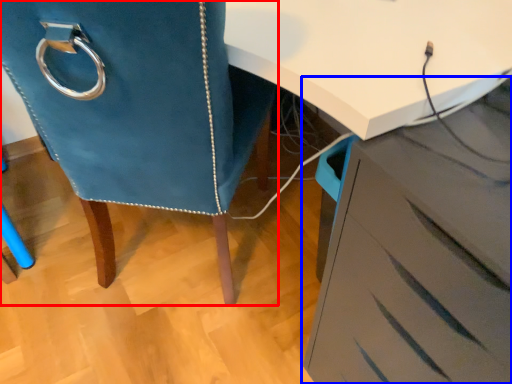
Question: Which point is further to the camera, furniture (highlighted by a red box) or chest of drawers (highlighted by a blue box)?

Choices:
 (A) furniture
 (B) chest of drawers

Answer: (A)